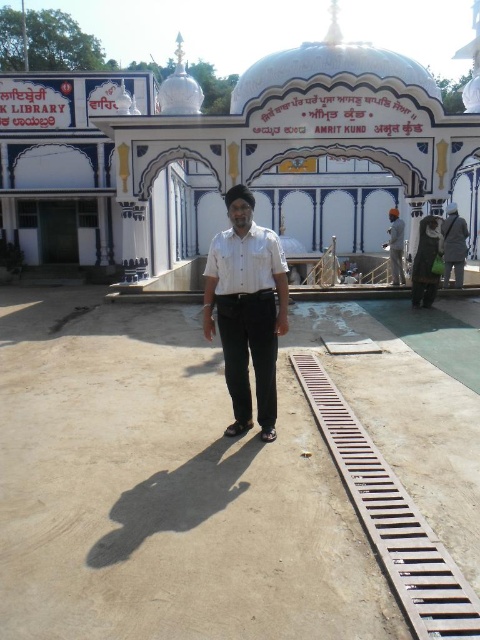
You are a visitor at the AMRIT KUND site and want to take a photo of the brown metal train track at lower right without the dark gray fabric uniform at right appearing in the frame. Which object should you position closer to the camera?

You should position the brown metal train track at lower right closer to the camera because it is in front of the dark gray fabric uniform at right, so moving it forward will block the uniform from view.